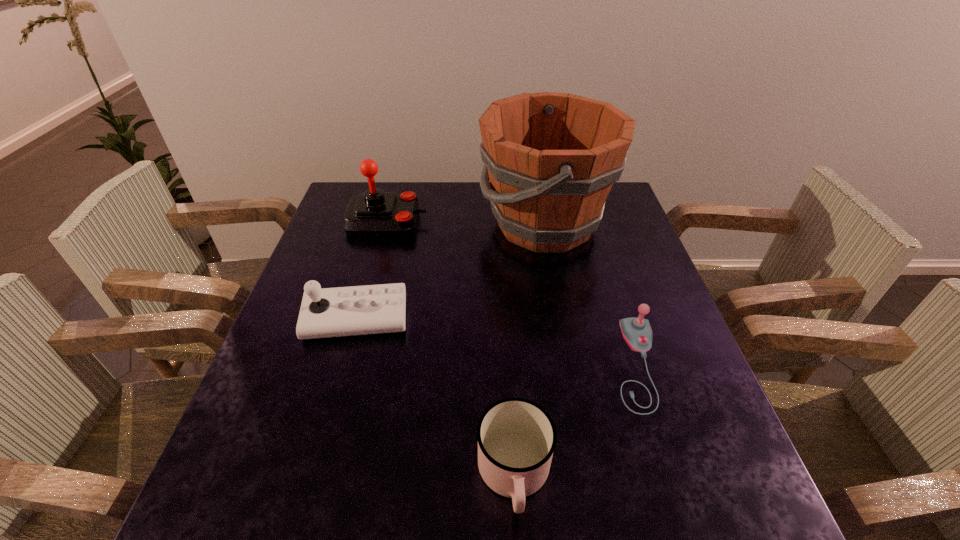
Where is `vacant region at the near edge of the desktop`? vacant region at the near edge of the desktop is located at coordinates (449, 525).

Where is `blank space at the left edge of the desktop`? blank space at the left edge of the desktop is located at coordinates (324, 235).

Where is `vacant region at the right edge of the desktop`? This screenshot has height=540, width=960. vacant region at the right edge of the desktop is located at coordinates (678, 345).

In the image, there is a desktop. Identify the location of free region at the far left corner. The height and width of the screenshot is (540, 960). (344, 212).

This screenshot has height=540, width=960. Identify the location of empty space between the rightmost joystick and the mug. (575, 420).

Locate an element on the screen. The height and width of the screenshot is (540, 960). free space between the second shortest joystick and the rightmost joystick is located at coordinates (496, 341).

Image resolution: width=960 pixels, height=540 pixels. In order to click on vacant space that is in between the nearest object and the shortest joystick in this screenshot , I will do `click(575, 420)`.

This screenshot has height=540, width=960. I want to click on vacant area that lies between the rightmost joystick and the mug, so click(x=575, y=420).

You are a GUI agent. You are given a task and a screenshot of the screen. Output one action in this format:
    pyautogui.click(x=<x>, y=<y>)
    Task: Click on the vacant region between the shortest joystick and the bucket
    The image size is (960, 540).
    Given the screenshot: What is the action you would take?
    pyautogui.click(x=590, y=294)

Locate an element on the screen. The width and height of the screenshot is (960, 540). vacant area between the mug and the shortest joystick is located at coordinates (575, 420).